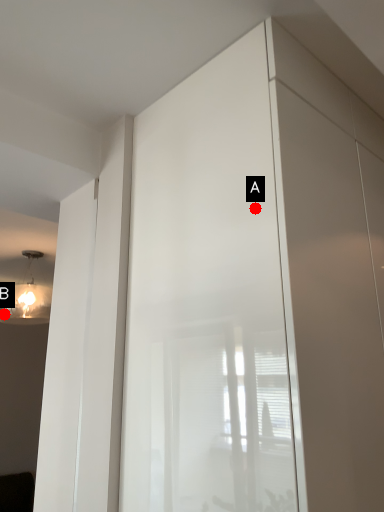
Question: Two points are circled on the image, labeled by A and B beside each circle. Which of the following is the closest to the observer?

Choices:
 (A) A is closer
 (B) B is closer

Answer: (A)